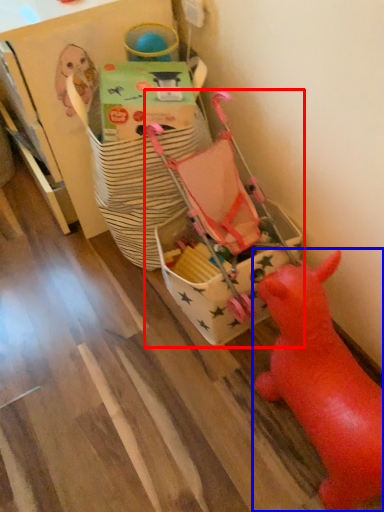
Question: Which point is further to the camera, toy (highlighted by a red box) or toy (highlighted by a blue box)?

Choices:
 (A) toy
 (B) toy

Answer: (A)